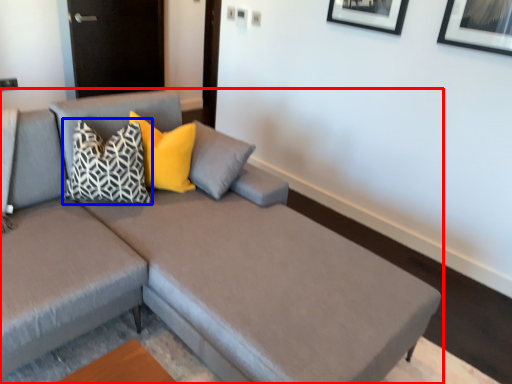
Question: Which object appears closest to the camera in this image, studio couch (highlighted by a red box) or pillow (highlighted by a blue box)?

Choices:
 (A) studio couch
 (B) pillow

Answer: (A)